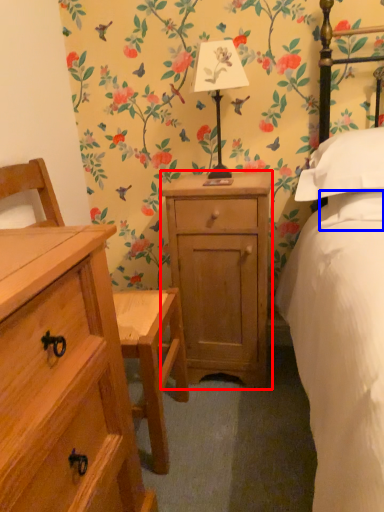
Question: Which of the following is the farthest to the observer, nightstand (highlighted by a red box) or pillow (highlighted by a blue box)?

Choices:
 (A) nightstand
 (B) pillow

Answer: (A)